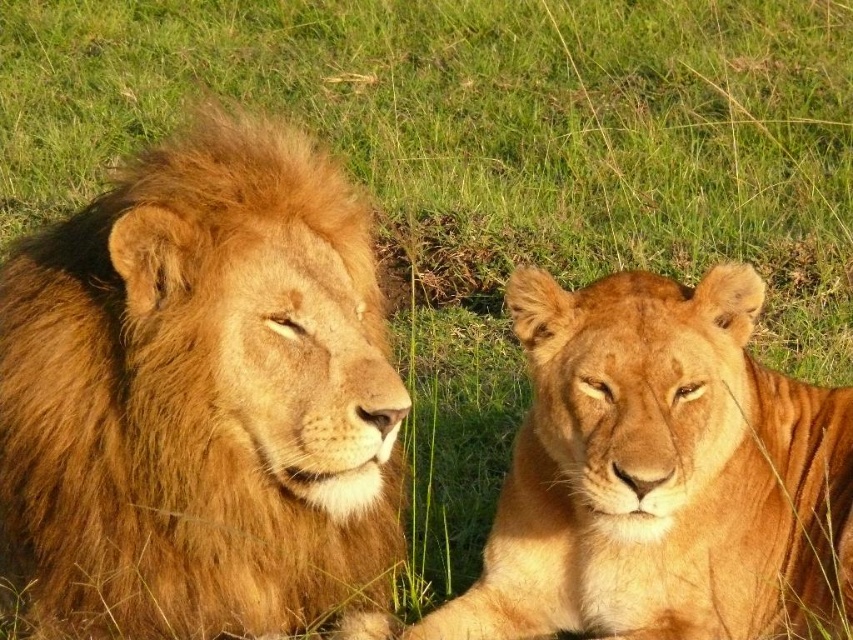
Is golden fur lion at left smaller than golden fur lion at right?

Correct, golden fur lion at left occupies less space than golden fur lion at right.

Can you confirm if golden fur lion at left is positioned above golden fur lion at right?

Indeed, golden fur lion at left is positioned over golden fur lion at right.

Who is more distant from viewer, (x=363, y=593) or (x=548, y=369)?

The point (x=363, y=593) is behind.

Identify the location of golden fur lion at left. (200, 400).